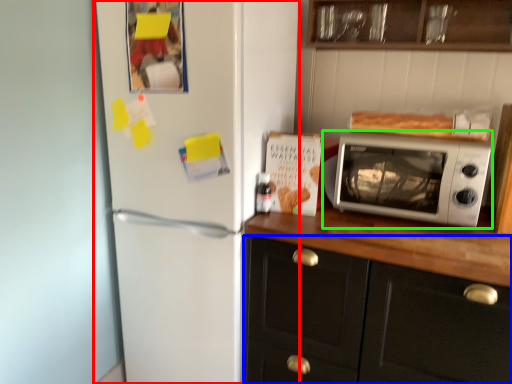
Question: Which object is positioned farthest from refrigerator (highlighted by a red box)? Select from cabinetry (highlighted by a blue box) and microwave oven (highlighted by a green box).

Choices:
 (A) cabinetry
 (B) microwave oven

Answer: (B)